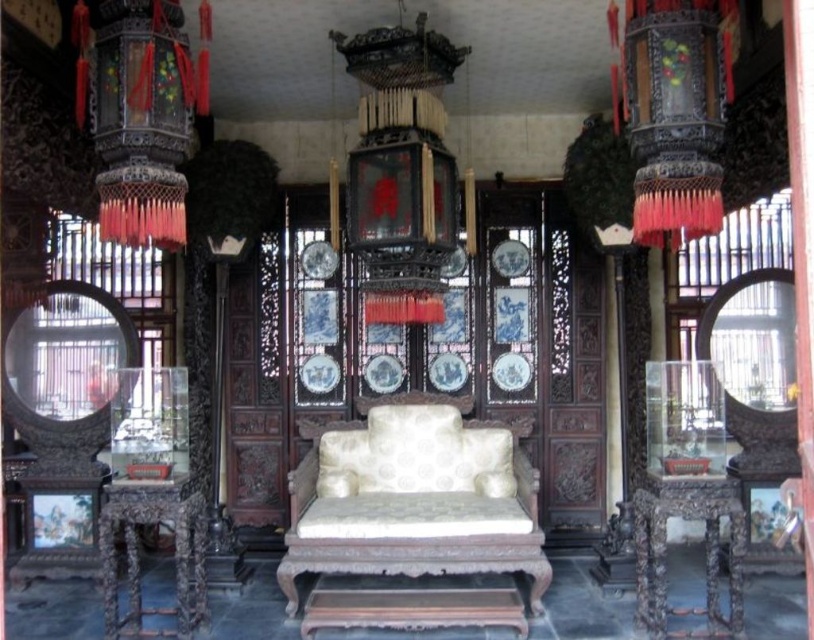
Question: Which object is positioned farthest from the carved wood side table at lower left?

Choices:
 (A) white upholstered armchair at center
 (B) dark brown wood side table at lower right

Answer: (B)

Question: Is black lacquered lantern at center to the left of carved wood side table at lower left from the viewer's perspective?

Choices:
 (A) yes
 (B) no

Answer: (B)

Question: Which of these objects is positioned farthest from the carved wood side table at lower left?

Choices:
 (A) dark brown wood side table at lower right
 (B) black lacquered lantern at upper right

Answer: (B)

Question: From the image, what is the correct spatial relationship of black lacquered lantern at upper right in relation to carved wood side table at lower left?

Choices:
 (A) below
 (B) above

Answer: (B)

Question: Does white upholstered armchair at center appear on the right side of black lacquered lantern at left?

Choices:
 (A) no
 (B) yes

Answer: (B)

Question: Which point is farther from the camera taking this photo?

Choices:
 (A) pyautogui.click(x=95, y=68)
 (B) pyautogui.click(x=536, y=486)
 (C) pyautogui.click(x=383, y=131)

Answer: (B)